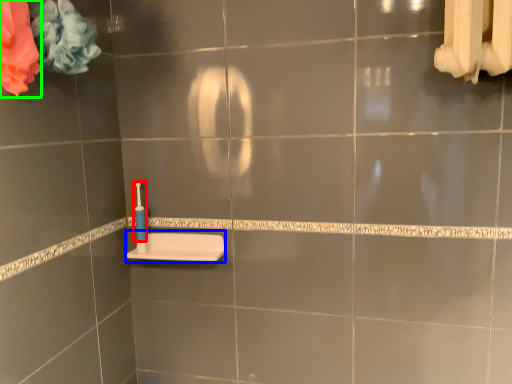
Question: Considering the real-world distances, which object is closest to toothbrush (highlighted by a red box)? sink (highlighted by a blue box) or flower (highlighted by a green box).

Choices:
 (A) sink
 (B) flower

Answer: (A)